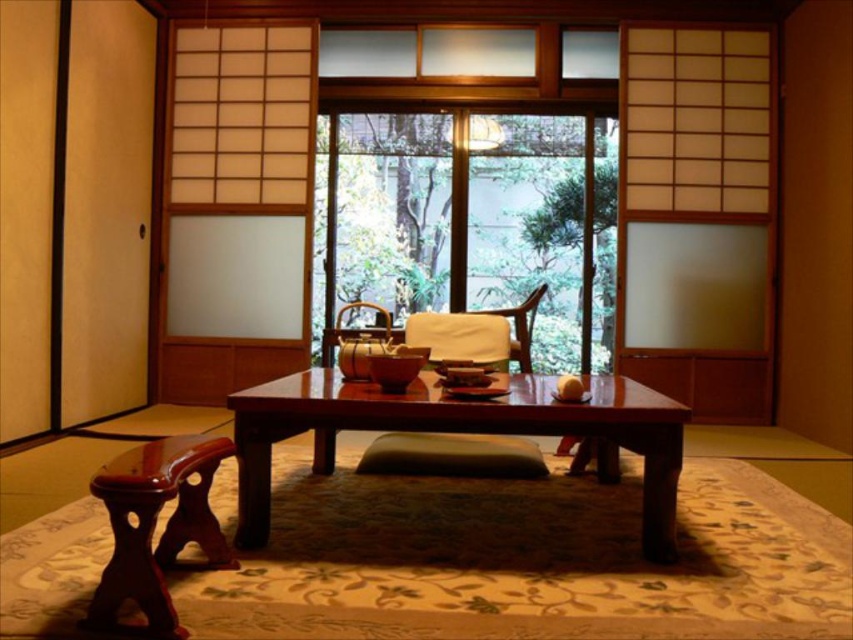
Question: Does green fabric cushion at center have a lesser width compared to white soft pillow at center?

Choices:
 (A) yes
 (B) no

Answer: (B)

Question: Which object is positioned closest to the brown leather chair at center?

Choices:
 (A) matte wood chair at center
 (B) mahogany wood stool at lower left
 (C) white soft pillow at center

Answer: (C)

Question: Does white soft pillow at center come in front of brown leather chair at center?

Choices:
 (A) no
 (B) yes

Answer: (A)

Question: Is green fabric cushion at center wider than matte wood chair at center?

Choices:
 (A) yes
 (B) no

Answer: (A)

Question: Which object is positioned farthest from the brown leather chair at center?

Choices:
 (A) matte wood chair at center
 (B) wooden table at center
 (C) green fabric cushion at center
 (D) mahogany wood stool at lower left

Answer: (A)

Question: Which point appears farthest from the camera in this image?

Choices:
 (A) (434, 320)
 (B) (244, 516)

Answer: (A)